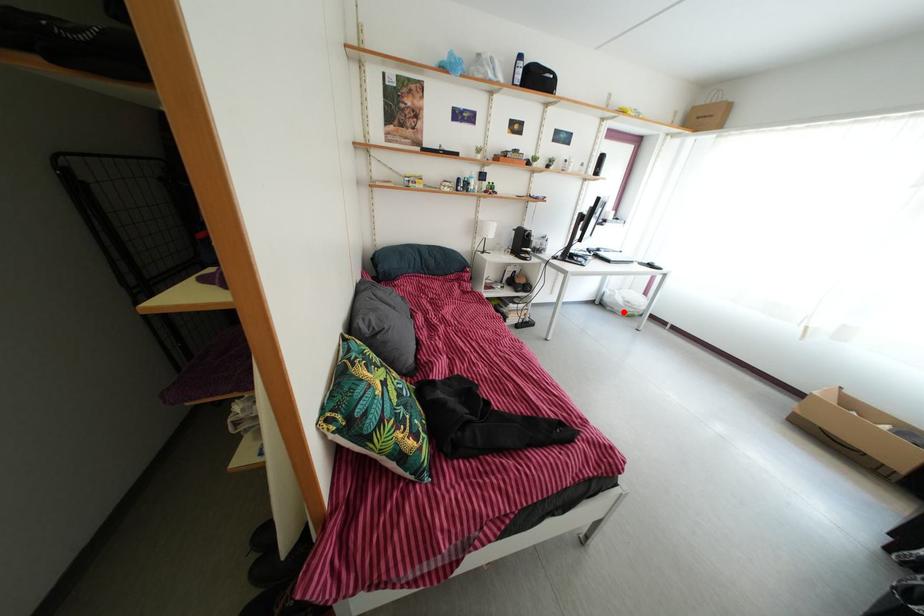
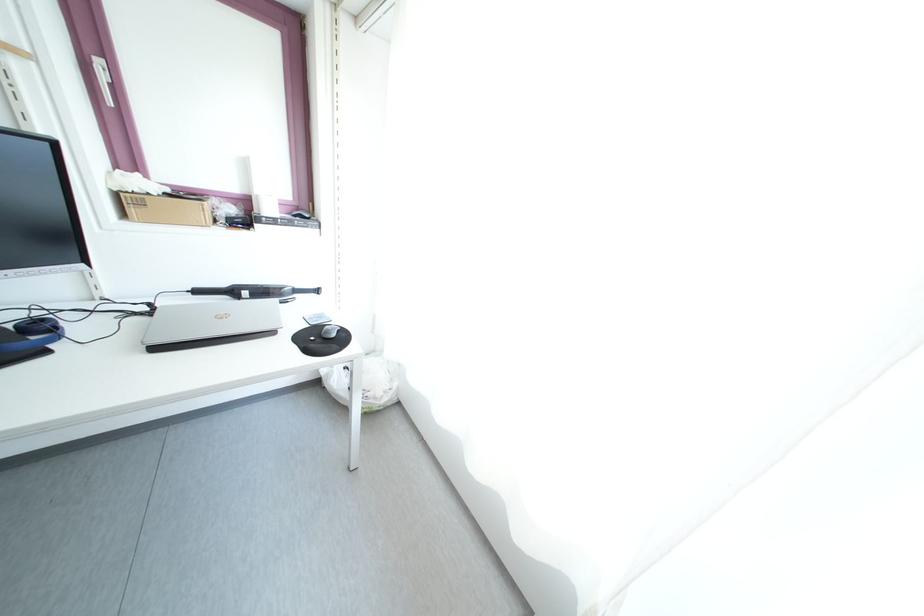
The point at the highlighted location is marked in the first image. Where is the corresponding point in the second image?

(344, 403)